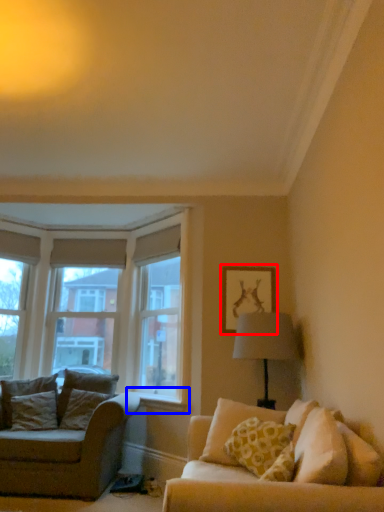
Question: Which object appears farthest to the camera in this image, picture frame (highlighted by a red box) or window sill (highlighted by a blue box)?

Choices:
 (A) picture frame
 (B) window sill

Answer: (A)